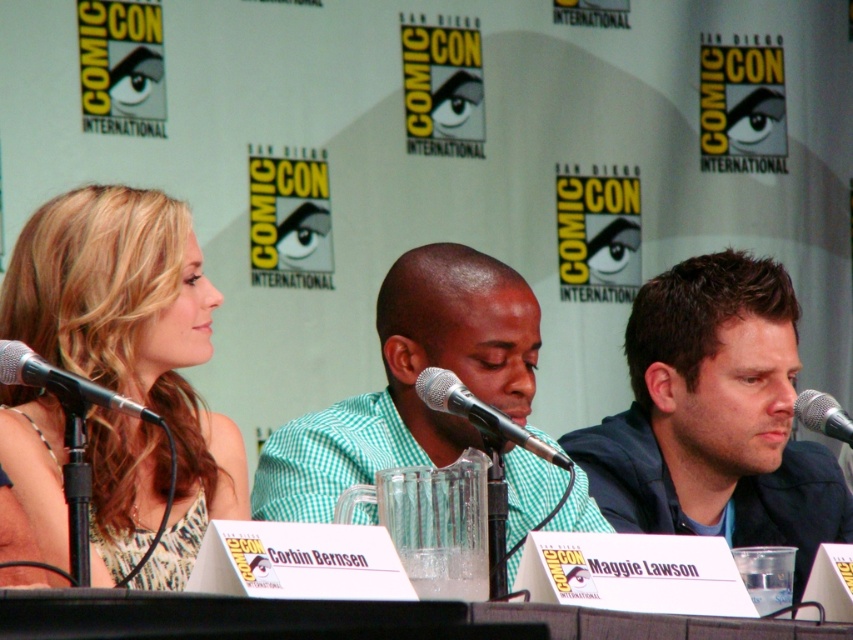
You are attending Comic Con and want to take a photo of the panel discussion. You have to choose between focusing on point A at coordinates point (13, 348) and point B at coordinates point (421, 387). Which point should you focus on to capture a clearer image?

Point A at coordinates point (13, 348) is closer to the viewer than point B at coordinates point (421, 387), so focusing on point A will result in a clearer image.

From the picture: You are a photographer at Comic Con and you want to take a photo of the panelists. The matte black microphone at left is located at point (62, 384). Where should you position yourself to ensure the microphone is centered in your camera view?

To center the matte black microphone at left at point (62, 384) in your camera view, position yourself directly in front of that point.